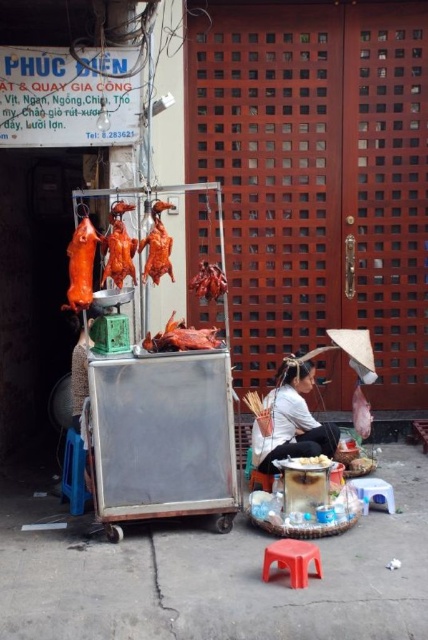
Question: Among these points, which one is farthest from the camera?

Choices:
 (A) (309, 413)
 (B) (363, 504)
 (C) (265, 563)

Answer: (A)

Question: Can you confirm if smooth plastic stool at lower center is positioned to the left of smoked reddish-brown meat at center?

Choices:
 (A) yes
 (B) no

Answer: (B)

Question: Is the position of shiny brown meat at center more distant than that of smooth plastic stool at lower center?

Choices:
 (A) yes
 (B) no

Answer: (B)

Question: Is smooth plastic stool at lower center positioned before smooth white plate at lower center?

Choices:
 (A) yes
 (B) no

Answer: (B)

Question: Estimate the real-world distances between objects in this image. Which object is farther from the shiny orange duck at center?

Choices:
 (A) smooth white plate at lower center
 (B) red plastic stool at lower center
 (C) smoked reddish-brown meat at center

Answer: (B)

Question: Which point appears farthest from the camera in this image?

Choices:
 (A) (323, 456)
 (B) (89, 296)

Answer: (A)